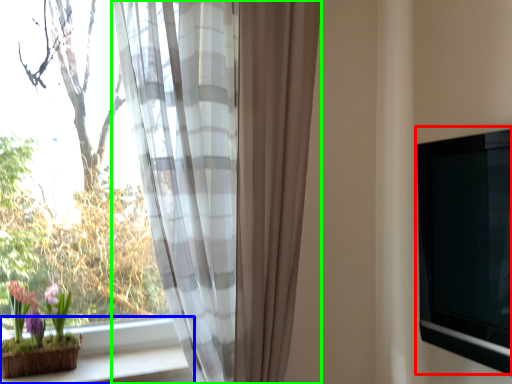
Question: Estimate the real-world distances between objects in this image. Which object is closer to window screen (highlighted by a red box), window sill (highlighted by a blue box) or curtain (highlighted by a green box)?

Choices:
 (A) window sill
 (B) curtain

Answer: (B)